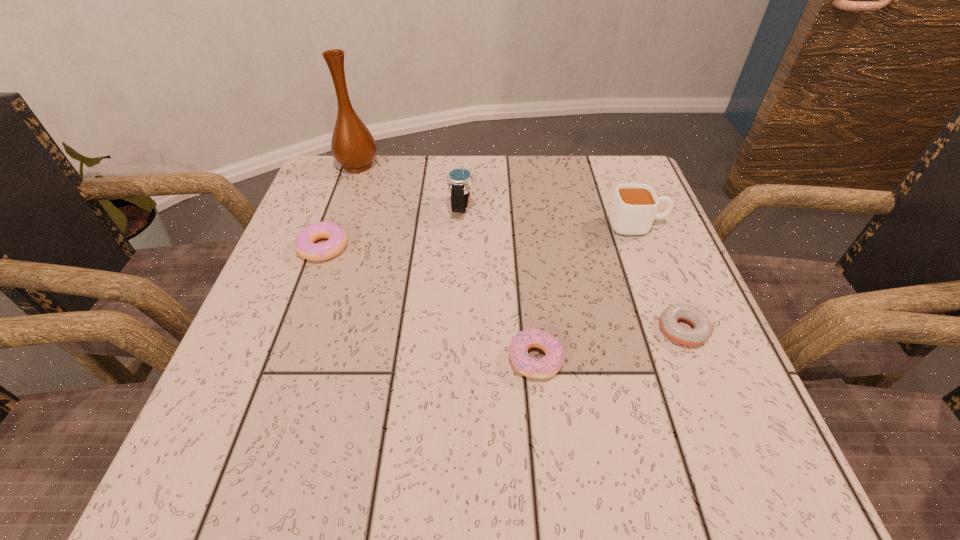
I want to click on free space at the far edge of the desktop, so click(399, 183).

Image resolution: width=960 pixels, height=540 pixels. I want to click on vacant space at the near edge of the desktop, so click(x=631, y=436).

The image size is (960, 540). In order to click on free spot at the left edge of the desktop in this screenshot , I will do `click(283, 278)`.

You are a GUI agent. You are given a task and a screenshot of the screen. Output one action in this format:
    pyautogui.click(x=<x>, y=<y>)
    Task: Click on the vacant area at the right edge
    The height and width of the screenshot is (540, 960).
    Given the screenshot: What is the action you would take?
    pyautogui.click(x=624, y=290)

Locate an element on the screen. The width and height of the screenshot is (960, 540). vacant space at the far left corner of the desktop is located at coordinates (373, 162).

This screenshot has height=540, width=960. I want to click on free region at the far right corner of the desktop, so click(x=611, y=163).

Locate an element on the screen. The width and height of the screenshot is (960, 540). vacant area between the vase and the fourth object from right to left is located at coordinates (410, 186).

This screenshot has width=960, height=540. What are the coordinates of `vacant point located between the farthest doughnut and the second doughnut from right to left` in the screenshot? It's located at (429, 303).

Find the location of a particular element. This screenshot has width=960, height=540. vacant region between the second doughnut from right to left and the farthest doughnut is located at coordinates (429, 303).

Identify the location of free space between the cup and the third object from left to right. The width and height of the screenshot is (960, 540). (550, 217).